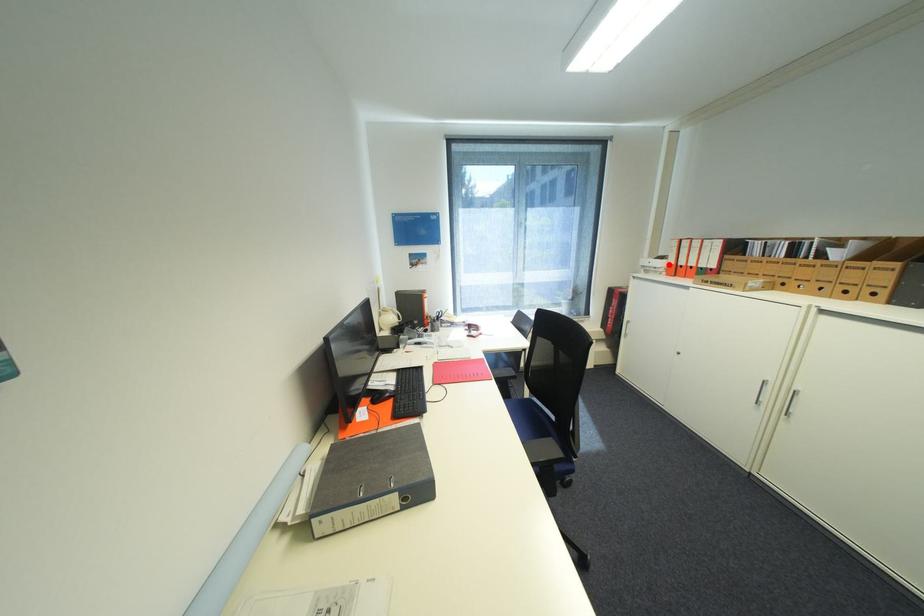
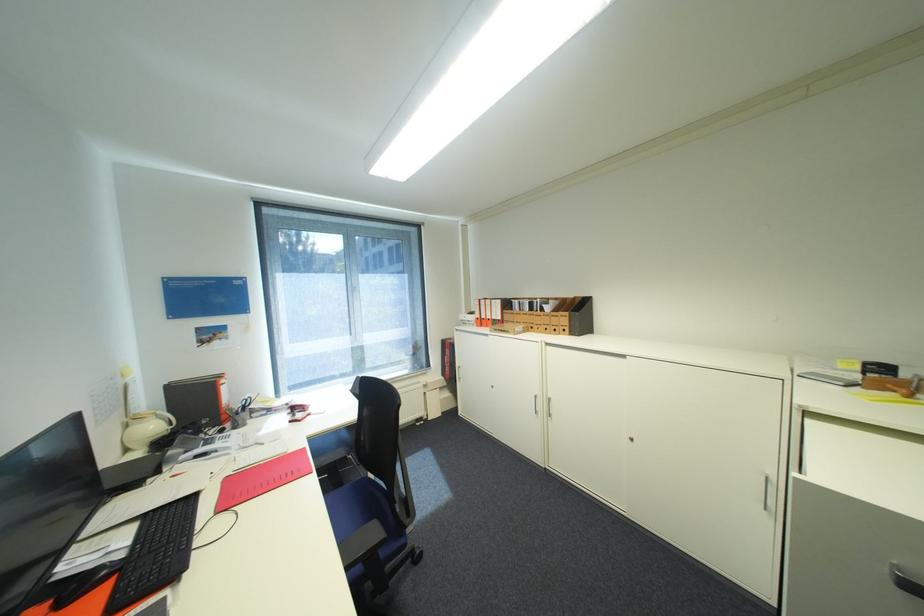
Locate, in the second image, the point that corresponds to the highlighted location in the first image.

(480, 318)